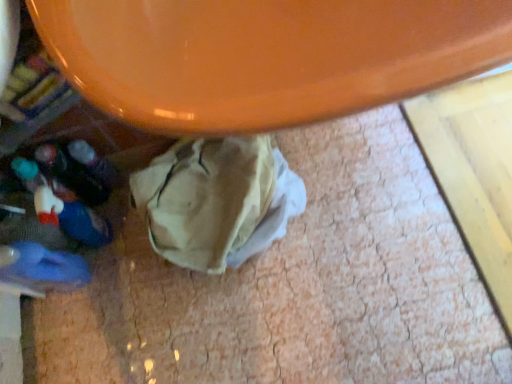
Question: Is blue rubber slipper at lower left closer to the viewer compared to orange glossy table at upper center?

Choices:
 (A) yes
 (B) no

Answer: (B)

Question: Can you confirm if blue rubber slipper at lower left is taller than orange glossy table at upper center?

Choices:
 (A) no
 (B) yes

Answer: (B)

Question: Does blue rubber slipper at lower left have a smaller size compared to orange glossy table at upper center?

Choices:
 (A) yes
 (B) no

Answer: (A)

Question: From a real-world perspective, does blue rubber slipper at lower left stand above orange glossy table at upper center?

Choices:
 (A) yes
 (B) no

Answer: (B)

Question: Is orange glossy table at upper center inside blue rubber slipper at lower left?

Choices:
 (A) no
 (B) yes

Answer: (A)

Question: Is blue rubber slipper at lower left shorter than orange glossy table at upper center?

Choices:
 (A) no
 (B) yes

Answer: (A)

Question: Can we say orange glossy table at upper center lies outside blue rubber slipper at lower left?

Choices:
 (A) yes
 (B) no

Answer: (A)

Question: Considering the relative sizes of orange glossy table at upper center and blue rubber slipper at lower left in the image provided, is orange glossy table at upper center shorter than blue rubber slipper at lower left?

Choices:
 (A) yes
 (B) no

Answer: (A)

Question: Could you tell me if orange glossy table at upper center is turned towards blue rubber slipper at lower left?

Choices:
 (A) yes
 (B) no

Answer: (B)

Question: Considering the relative positions of orange glossy table at upper center and blue rubber slipper at lower left in the image provided, is orange glossy table at upper center in front of blue rubber slipper at lower left?

Choices:
 (A) yes
 (B) no

Answer: (A)

Question: From the image's perspective, would you say orange glossy table at upper center is positioned over blue rubber slipper at lower left?

Choices:
 (A) no
 (B) yes

Answer: (B)

Question: Does orange glossy table at upper center contain blue rubber slipper at lower left?

Choices:
 (A) yes
 (B) no

Answer: (B)

Question: Is orange glossy table at upper center situated inside blue rubber slipper at lower left or outside?

Choices:
 (A) inside
 (B) outside

Answer: (B)